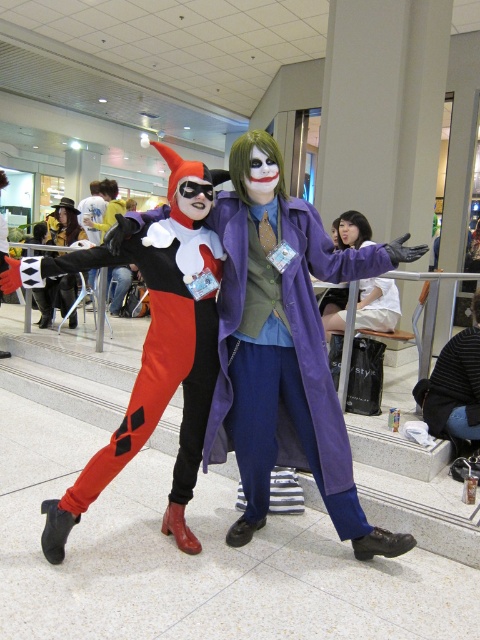
Which is behind, point (122, 461) or point (424, 397)?

Point (424, 397)

Between point (120, 435) and point (454, 435), which one is positioned in front?

Point (120, 435) is in front.

Image resolution: width=480 pixels, height=640 pixels. Identify the location of matte black and red spandex pants at center. (156, 371).

What do you see at coordinates (284, 346) in the screenshot?
I see `matte black and white costume at center` at bounding box center [284, 346].

Is point (342, 426) farther from viewer compared to point (322, 483)?

That is False.

This screenshot has width=480, height=640. I want to click on matte black and white costume at center, so click(x=284, y=346).

Between purple fabric coat at center and matte black and red spandex pants at center, which one appears on the left side from the viewer's perspective?

matte black and red spandex pants at center

The height and width of the screenshot is (640, 480). What do you see at coordinates (284, 365) in the screenshot? I see `purple fabric coat at center` at bounding box center [284, 365].

The image size is (480, 640). What do you see at coordinates (284, 365) in the screenshot?
I see `purple fabric coat at center` at bounding box center [284, 365].

Identify the location of purple fabric coat at center. The image size is (480, 640). (284, 365).